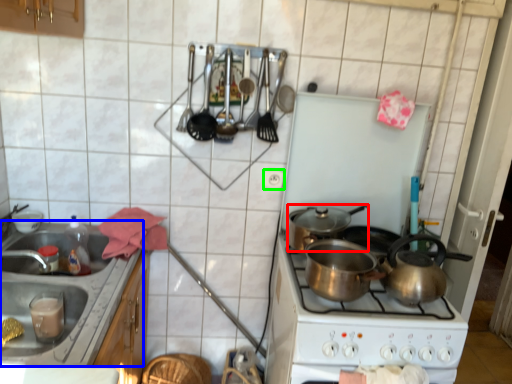
Question: Based on their relative distances, which object is farther from kitchen appliance (highlighted by a red box)? Choose from sink (highlighted by a blue box) and electric outlet (highlighted by a green box).

Choices:
 (A) sink
 (B) electric outlet

Answer: (A)